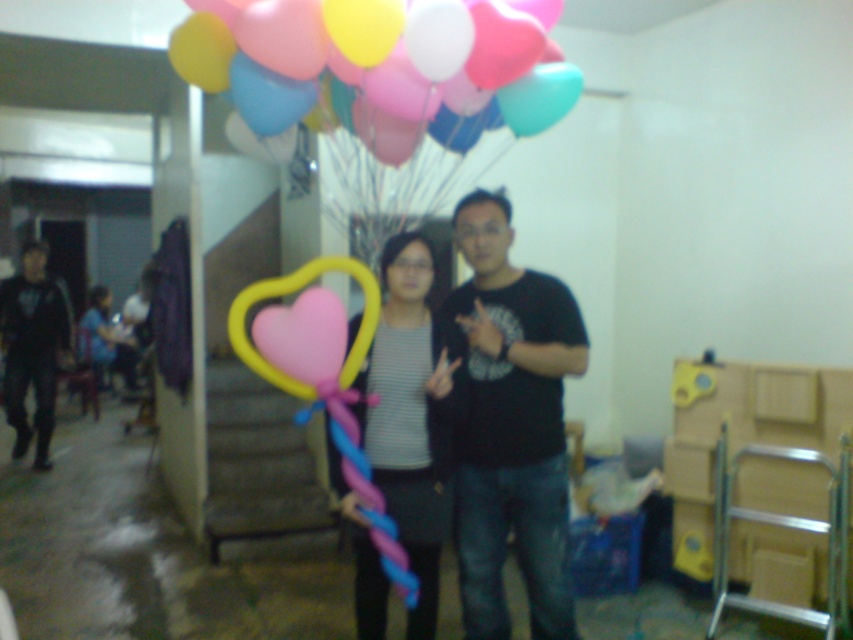
You are a photographer at the event and want to capture both the striped fabric shirt at center and the black matte pants at left in a single shot. Which one should you focus on to ensure both are in clear view?

The striped fabric shirt at center is closer to the viewer than the black matte pants at left, so focusing on the striped fabric shirt at center will help ensure both are in clear view.

You are organizing a photoshoot and need to ensure that the striped fabric shirt at center and the black matte pants at left are visible in the frame. Given that the camera can only capture items with a width of at least 20 cm, can both items be captured clearly?

The striped fabric shirt at center has a lesser width compared to black matte pants at left. However, since the minimum required width is 20 cm, we need to know the exact widths of both items to determine visibility. Unfortunately, the provided information does not specify their actual widths, only their relative sizes. Therefore, it is uncertain if both items meet the 20 cm requirement.

You are a photographer trying to capture a photo of the matte balloons at upper center and the striped fabric shirt at center. Which object should you focus on first if you want to ensure both are in the frame without moving the camera?

The striped fabric shirt at center should be focused on first because the matte balloons at upper center is not as tall as striped fabric shirt at center, so adjusting focus to the taller object ensures both are in frame.